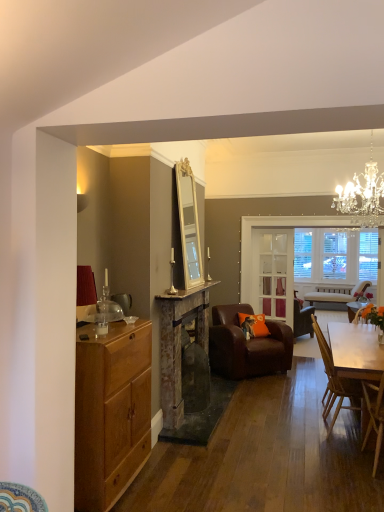
What do you see at coordinates (374, 416) in the screenshot? The height and width of the screenshot is (512, 384). I see `wooden chair at lower right, the first chair in the front-to-back sequence` at bounding box center [374, 416].

I want to click on wooden chair at lower right, which is the 3th chair from back to front, so click(374, 416).

Consider the image. In order to face wooden chair at right, marked as the second chair in a front-to-back arrangement, should I rotate leftwards or rightwards?

Rotate your view right by about 19.716°.

You are a GUI agent. You are given a task and a screenshot of the screen. Output one action in this format:
    pyautogui.click(x=<x>, y=<y>)
    Task: Click on the wooden chair at right, marked as the second chair in a front-to-back arrangement
    Image resolution: width=384 pixels, height=512 pixels.
    Given the screenshot: What is the action you would take?
    pyautogui.click(x=335, y=381)

The image size is (384, 512). What do you see at coordinates (247, 345) in the screenshot? I see `brown leather armchair at center, which is counted as the first chair, starting from the back` at bounding box center [247, 345].

Describe the element at coordinates (188, 370) in the screenshot. The width and height of the screenshot is (384, 512). I see `rustic stone fireplace at center` at that location.

Identify the location of rustic stone fireplace at center. (188, 370).

Locate an element on the screen. This screenshot has width=384, height=512. orange fabric pillow at center is located at coordinates (254, 324).

Measure the distance between clear glass door at center and camera.

clear glass door at center is 5.73 meters away from camera.

The image size is (384, 512). Describe the element at coordinates (273, 273) in the screenshot. I see `clear glass door at center` at that location.

What are the coordinates of `wooden chair at lower right, the first chair in the front-to-back sequence` in the screenshot? It's located at (374, 416).

Considering the relative positions of orange fabric pillow at center and wooden chair at lower right, which is the 3th chair from back to front, in the image provided, is orange fabric pillow at center to the right of wooden chair at lower right, which is the 3th chair from back to front, from the viewer's perspective?

No.

From the picture: How much distance is there between orange fabric pillow at center and wooden chair at lower right, the first chair in the front-to-back sequence?

orange fabric pillow at center and wooden chair at lower right, the first chair in the front-to-back sequence, are 1.92 meters apart.

Which is in front, point (243, 324) or point (362, 384)?

The point (362, 384) is closer.

Does orange fabric pillow at center touch wooden chair at lower right, the first chair in the front-to-back sequence?

They are not placed beside each other.

How different are the orientations of wooden chair at lower right, which is the 3th chair from back to front, and clear glass door at center in degrees?

wooden chair at lower right, which is the 3th chair from back to front, and clear glass door at center are facing 178 degrees away from each other.

Consider the image. From the image's perspective, who appears lower, wooden chair at lower right, which is the 3th chair from back to front, or clear glass door at center?

wooden chair at lower right, which is the 3th chair from back to front, from the image's perspective.

Who is shorter, wooden chair at lower right, which is the 3th chair from back to front, or clear glass door at center?

wooden chair at lower right, which is the 3th chair from back to front, is shorter.

In the scene shown: Is wooden chair at lower right, which is the 3th chair from back to front, closer to camera compared to clear glass door at center?

Yes, it is in front of clear glass door at center.

From a real-world perspective, is orange fabric pillow at center physically located above or below rustic stone fireplace at center?

In terms of real-world spatial position, orange fabric pillow at center is below rustic stone fireplace at center.

At what (x,y) coordinates should I click in order to perform the action: click on pillow below the rustic stone fireplace at center (from a real-world perspective). Please return your answer as a coordinate pair (x, y). This screenshot has height=512, width=384. Looking at the image, I should click on (254, 324).

Which is behind, orange fabric pillow at center or rustic stone fireplace at center?

orange fabric pillow at center is behind.

From the picture: Is orange fabric pillow at center bigger than rustic stone fireplace at center?

No.

In the scene shown: Considering the positions of objects clear glass door at center and rustic stone fireplace at center in the image provided, who is more to the left, clear glass door at center or rustic stone fireplace at center?

From the viewer's perspective, rustic stone fireplace at center appears more on the left side.

Does point (253, 272) come farther from viewer compared to point (191, 379)?

Yes, it is behind point (191, 379).

From the image's perspective, is clear glass door at center over rustic stone fireplace at center?

Indeed, from the image's perspective, clear glass door at center is shown above rustic stone fireplace at center.

Can you confirm if clear glass door at center is wider than rustic stone fireplace at center?

No, clear glass door at center is not wider than rustic stone fireplace at center.

How distant is wooden chair at right, marked as the second chair in a front-to-back arrangement, from brown leather armchair at center, the 3th chair viewed from the front?

A distance of 3.46 feet exists between wooden chair at right, marked as the second chair in a front-to-back arrangement, and brown leather armchair at center, the 3th chair viewed from the front.

At what (x,y) coordinates should I click in order to perform the action: click on chair that appears below the wooden chair at right, marked as the second chair in a front-to-back arrangement (from a real-world perspective). Please return your answer as a coordinate pair (x, y). This screenshot has width=384, height=512. Looking at the image, I should click on (247, 345).

Is wooden chair at right, placed as the 2th chair when sorted from back to front, turned away from brown leather armchair at center, which is counted as the first chair, starting from the back?

wooden chair at right, placed as the 2th chair when sorted from back to front, does not have its back to brown leather armchair at center, which is counted as the first chair, starting from the back.

From the picture: From a real-world perspective, does wooden chair at right, placed as the 2th chair when sorted from back to front, stand above brown leather armchair at center, the 3th chair viewed from the front?

Yes.

Considering the sizes of objects rustic stone fireplace at center and crystal chandelier at upper right in the image provided, who is thinner, rustic stone fireplace at center or crystal chandelier at upper right?

Thinner between the two is rustic stone fireplace at center.

Can we say rustic stone fireplace at center lies outside crystal chandelier at upper right?

rustic stone fireplace at center lies outside crystal chandelier at upper right's area.

Is rustic stone fireplace at center aimed at crystal chandelier at upper right?

No, rustic stone fireplace at center is not aimed at crystal chandelier at upper right.

From the image's perspective, which one is positioned higher, rustic stone fireplace at center or crystal chandelier at upper right?

From the image's view, crystal chandelier at upper right is above.

Is brown leather armchair at center, which is counted as the first chair, starting from the back, taller or shorter than rustic stone fireplace at center?

Clearly, brown leather armchair at center, which is counted as the first chair, starting from the back, is shorter compared to rustic stone fireplace at center.

Is there a large distance between brown leather armchair at center, which is counted as the first chair, starting from the back, and rustic stone fireplace at center?

That's not correct — brown leather armchair at center, which is counted as the first chair, starting from the back, is a little close to rustic stone fireplace at center.

What's the angular difference between brown leather armchair at center, which is counted as the first chair, starting from the back, and rustic stone fireplace at center's facing directions?

The angular difference between brown leather armchair at center, which is counted as the first chair, starting from the back, and rustic stone fireplace at center is 45.1 degrees.

Which is more to the right, brown leather armchair at center, which is counted as the first chair, starting from the back, or rustic stone fireplace at center?

brown leather armchair at center, which is counted as the first chair, starting from the back.

Locate an element on the screen. This screenshot has width=384, height=512. the 1st chair positioned below the orange fabric pillow at center (from a real-world perspective) is located at coordinates (374, 416).

Where is `glass door that is above the wooden chair at lower right, the first chair in the front-to-back sequence (from a real-world perspective)`? Image resolution: width=384 pixels, height=512 pixels. glass door that is above the wooden chair at lower right, the first chair in the front-to-back sequence (from a real-world perspective) is located at coordinates (273, 273).

Considering their positions, is brown leather armchair at center, the 3th chair viewed from the front, positioned closer to wooden chair at right, marked as the second chair in a front-to-back arrangement, than wooden chair at lower right, which is the 3th chair from back to front?

Based on the image, wooden chair at lower right, which is the 3th chair from back to front, appears to be nearer to wooden chair at right, marked as the second chair in a front-to-back arrangement.

From the image, which object appears to be farther from orange fabric pillow at center, wooden chair at right, placed as the 2th chair when sorted from back to front, or brown leather armchair at center, the 3th chair viewed from the front?

Among the two, wooden chair at right, placed as the 2th chair when sorted from back to front, is located further to orange fabric pillow at center.

Which object lies nearer to the anchor point wooden chair at lower right, the first chair in the front-to-back sequence, rustic stone fireplace at center or wooden chair at right, marked as the second chair in a front-to-back arrangement?

Among the two, wooden chair at right, marked as the second chair in a front-to-back arrangement, is located nearer to wooden chair at lower right, the first chair in the front-to-back sequence.

Based on their spatial positions, is light brown wood cabinet at left or rustic stone fireplace at center further from crystal chandelier at upper right?

light brown wood cabinet at left is further to crystal chandelier at upper right.

Considering their positions, is wooden chair at right, placed as the 2th chair when sorted from back to front, positioned closer to orange fabric pillow at center than clear glass door at center?

The object closer to orange fabric pillow at center is clear glass door at center.

Based on the photo, looking at the image, which one is located further to orange fabric pillow at center, clear glass door at center or brown leather armchair at center, which is counted as the first chair, starting from the back?

clear glass door at center lies further to orange fabric pillow at center than the other object.

When comparing their distances from orange fabric pillow at center, does light brown wood cabinet at left or crystal chandelier at upper right seem closer?

crystal chandelier at upper right is closer to orange fabric pillow at center.

When comparing their distances from crystal chandelier at upper right, does rustic stone fireplace at center or wooden chair at right, marked as the second chair in a front-to-back arrangement, seem further?

rustic stone fireplace at center is further to crystal chandelier at upper right.

Locate an element on the screen. pillow positioned between light brown wood cabinet at left and clear glass door at center from near to far is located at coordinates (254, 324).

Where is `pillow positioned between brown leather armchair at center, the 3th chair viewed from the front, and clear glass door at center from near to far`? pillow positioned between brown leather armchair at center, the 3th chair viewed from the front, and clear glass door at center from near to far is located at coordinates (254, 324).

Identify the location of fireplace between light brown wood cabinet at left and clear glass door at center in the front-back direction. (188, 370).

Find the location of a particular element. This screenshot has width=384, height=512. pillow between rustic stone fireplace at center and clear glass door at center in the front-back direction is located at coordinates (254, 324).